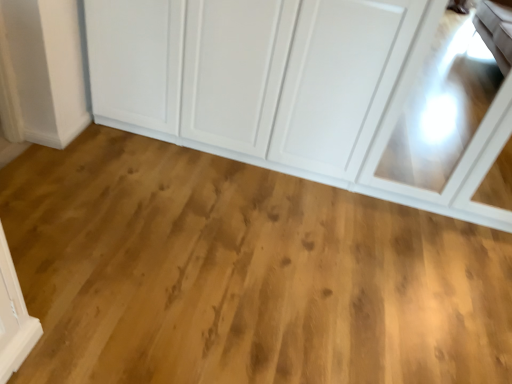
At what (x,y) coordinates should I click in order to perform the action: click on blank space situated above natural wood floor at center (from a real-world perspective). Please return your answer as a coordinate pair (x, y). Looking at the image, I should click on (242, 246).